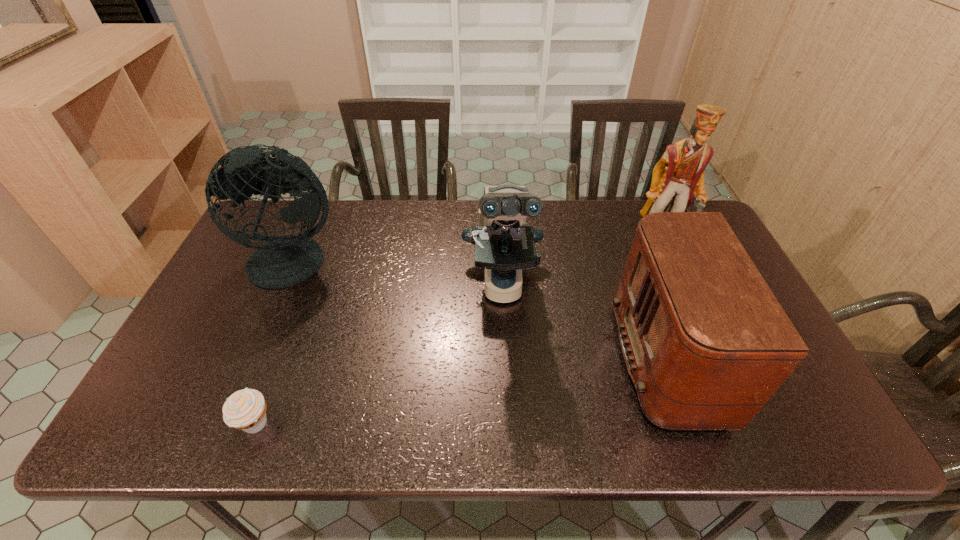
Image resolution: width=960 pixels, height=540 pixels. Identify the location of nutcracker. (678, 177).

Locate an element on the screen. The width and height of the screenshot is (960, 540). the third object from right to left is located at coordinates (504, 245).

The height and width of the screenshot is (540, 960). Find the location of `globe`. globe is located at coordinates (284, 261).

I want to click on the second shortest object, so click(x=706, y=343).

You are a GUI agent. You are given a task and a screenshot of the screen. Output one action in this format:
    pyautogui.click(x=<x>, y=<y>)
    Task: Click on the muffin
    This screenshot has height=540, width=960.
    Given the screenshot: What is the action you would take?
    pyautogui.click(x=245, y=410)

The height and width of the screenshot is (540, 960). Find the location of `free region located on the front-facing side of the nutcracker`. free region located on the front-facing side of the nutcracker is located at coordinates (711, 353).

Identify the location of vacant region located through the eyepieces of the third object from left to right. tap(506, 352).

What are the coordinates of `free spot located on the front-facing side of the globe` in the screenshot? It's located at (242, 386).

The height and width of the screenshot is (540, 960). Find the location of `free point located 0.320m on the front panel of the second shortest object`. free point located 0.320m on the front panel of the second shortest object is located at coordinates (489, 360).

This screenshot has width=960, height=540. In order to click on free space located on the front panel of the second shortest object in this screenshot , I will do `click(581, 360)`.